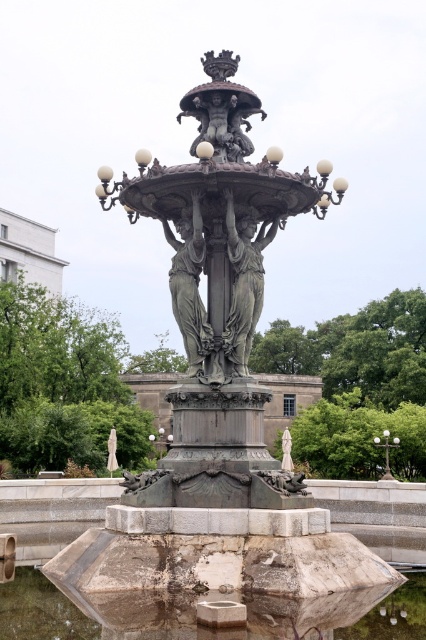
You are a tourist standing in front of the fountain and want to take a photo of the polished bronze statue at center. However, you notice the matte bronze lamp post at center is blocking your view. Based on the scene description, can you determine if the lamp post is behind or in front of the statue?

The polished bronze statue at center is in front of the matte bronze lamp post at center, so the lamp post is behind the statue and not blocking your view.